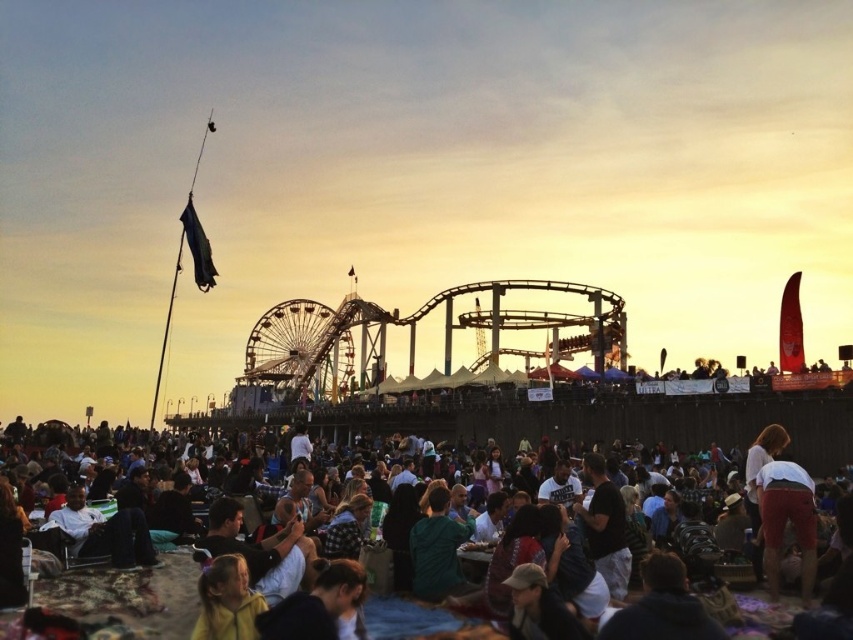
Question: Which of the following is the farthest from the observer?

Choices:
 (A) click(x=338, y=342)
 (B) click(x=715, y=588)
 (C) click(x=376, y=317)

Answer: (A)

Question: Which point is farther to the camera?

Choices:
 (A) metallic ferris wheel at center
 (B) dark clothing crowd at lower center

Answer: (A)

Question: Does metallic roller coaster at center appear over metallic ferris wheel at center?

Choices:
 (A) yes
 (B) no

Answer: (A)

Question: Is dark clothing crowd at lower center smaller than metallic ferris wheel at center?

Choices:
 (A) no
 (B) yes

Answer: (A)

Question: Among these points, which one is nearest to the camera?

Choices:
 (A) (234, 500)
 (B) (292, 388)

Answer: (A)

Question: Can you confirm if dark clothing crowd at lower center is positioned above metallic roller coaster at center?

Choices:
 (A) yes
 (B) no

Answer: (B)